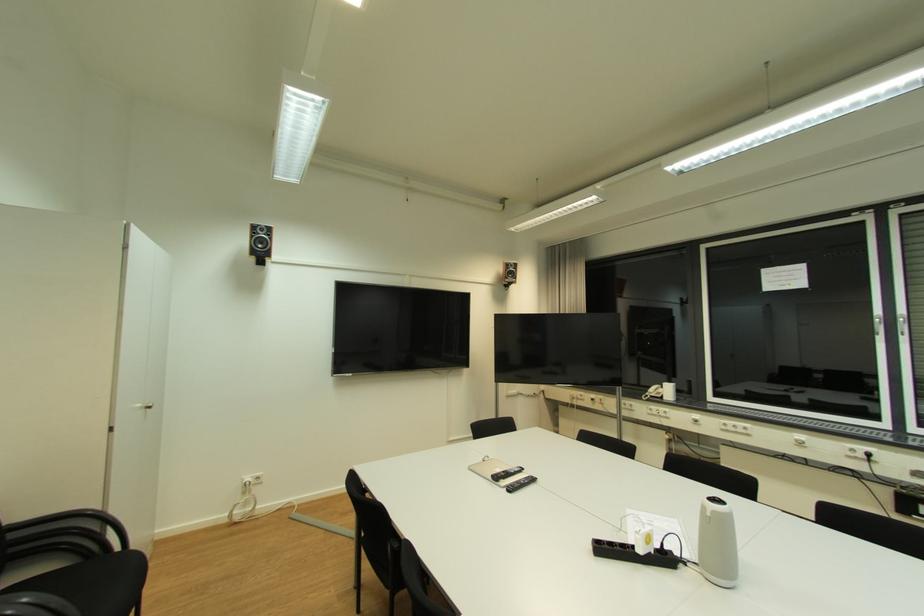
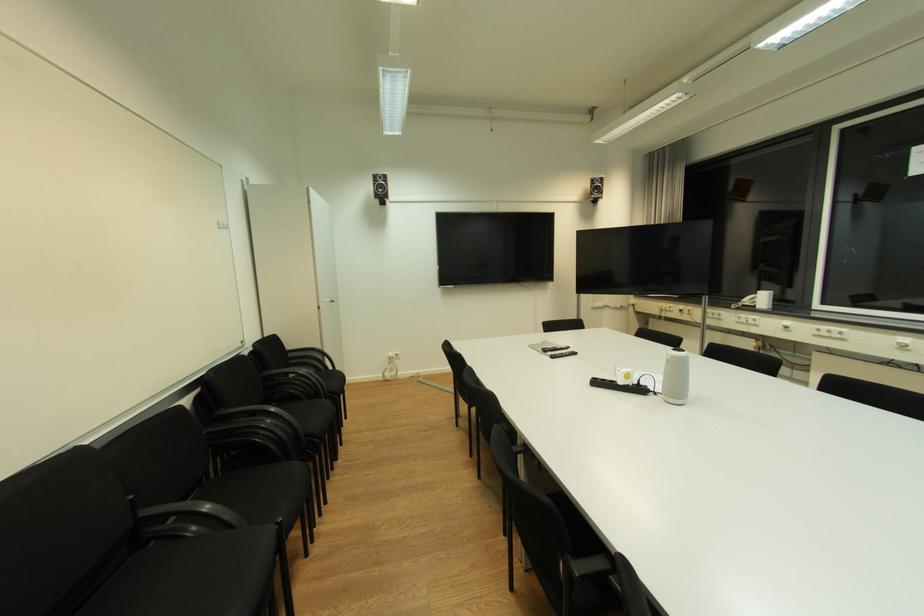
Locate, in the second image, the point that corresponds to (x=720, y=513) in the first image.

(678, 358)